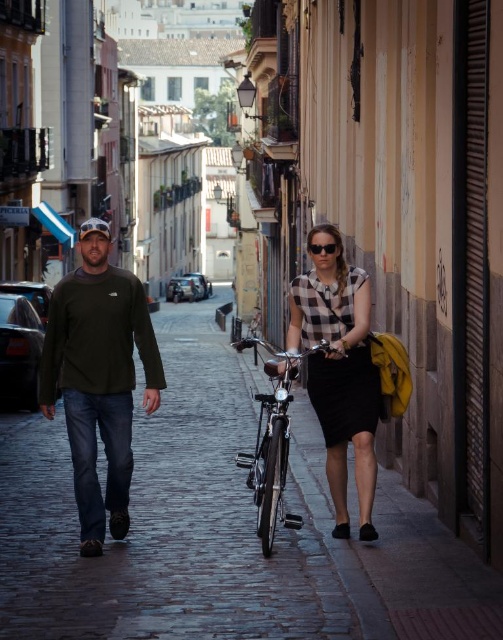
You are a photographer standing at the end of the cobblestone street. You want to take a photo that includes both the checkered fabric shirt at center and the shiny metallic bicycle at center. Considering their sizes, which object should you focus on first to ensure both are clearly visible in the frame?

The checkered fabric shirt at center has a smaller size compared to the shiny metallic bicycle at center, so you should focus on the checkered fabric shirt at center first to ensure both are clearly visible in the frame.

You are standing at the point labeled as point (339,252) and want to walk towards the point labeled as point (367,508). Which direction should you move?

You should move forward because point (367,508) is in front of point (339,252).

You are a photographer standing on the cobblestone street and want to capture both the checkered fabric shirt at center and the black matte dress at center in a single frame. Considering their sizes, which one will appear wider in the photo?

The checkered fabric shirt at center will appear wider in the photo because its width is larger than the black matte dress at center.